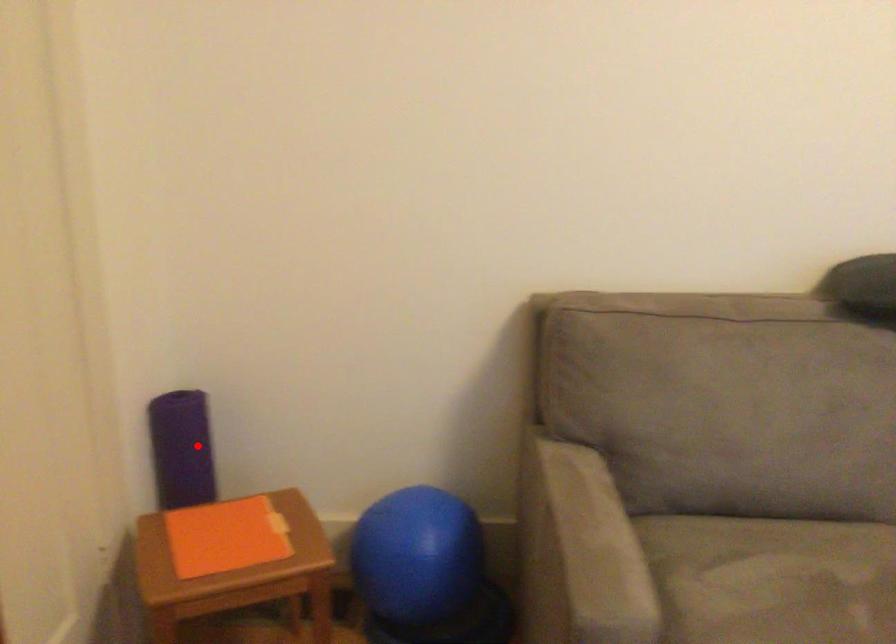
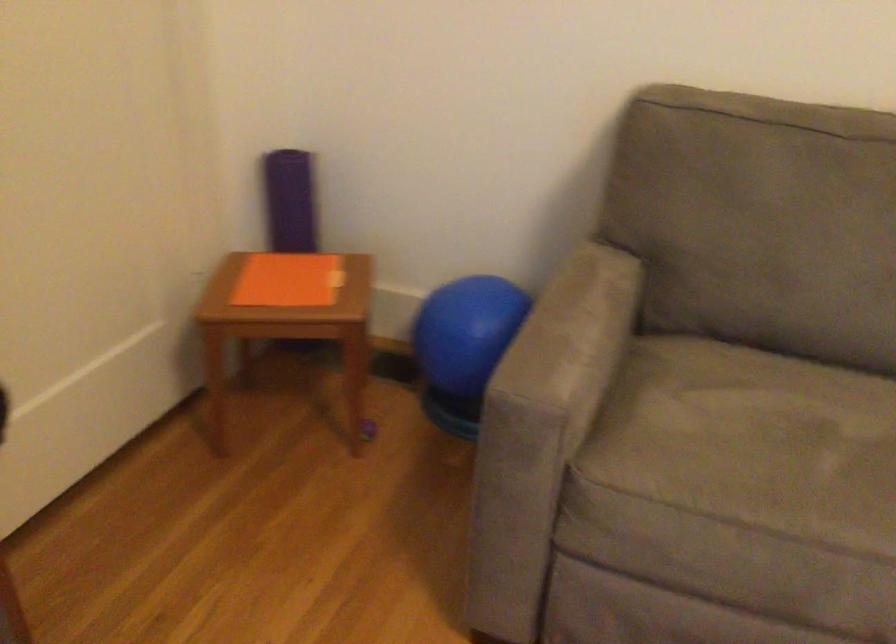
The point at the highlighted location is marked in the first image. Where is the corresponding point in the second image?

(289, 201)